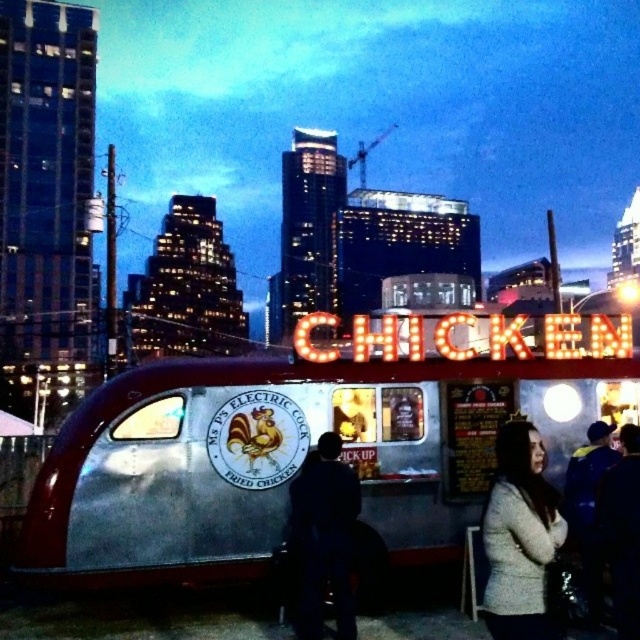
In the scene shown: Is neontexturedsign at center taller than dark fabric jacket at center?

Incorrect, neontexturedsign at center's height is not larger of dark fabric jacket at center's.

Is point (467, 321) more distant than point (298, 556)?

That is True.

This screenshot has height=640, width=640. I want to click on neontexturedsign at center, so click(x=467, y=339).

Can you confirm if silver metallic food truck at center is positioned to the left of light gray sweater at lower right?

Indeed, silver metallic food truck at center is positioned on the left side of light gray sweater at lower right.

Looking at this image, measure the distance between silver metallic food truck at center and light gray sweater at lower right.

They are 4.12 meters apart.

Is point (99, 388) positioned before point (490, 608)?

That is False.

Image resolution: width=640 pixels, height=640 pixels. I want to click on silver metallic food truck at center, so click(x=301, y=445).

How far apart are light gray sweater at lower right and neontexturedsign at center?

They are 14.11 feet apart.

Between light gray sweater at lower right and neontexturedsign at center, which one appears on the right side from the viewer's perspective?

neontexturedsign at center

You are a GUI agent. You are given a task and a screenshot of the screen. Output one action in this format:
    pyautogui.click(x=<x>, y=<y>)
    Task: Click on the light gray sweater at lower right
    
    Given the screenshot: What is the action you would take?
    pyautogui.click(x=518, y=536)

Identify the location of light gray sweater at lower right. (518, 536).